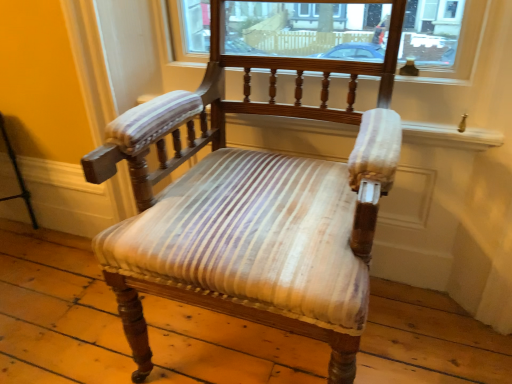
This screenshot has height=384, width=512. What do you see at coordinates (251, 208) in the screenshot?
I see `striped fabric chair at center` at bounding box center [251, 208].

Find the location of `striped fabric chair at center`. striped fabric chair at center is located at coordinates (251, 208).

I want to click on striped fabric chair at center, so click(251, 208).